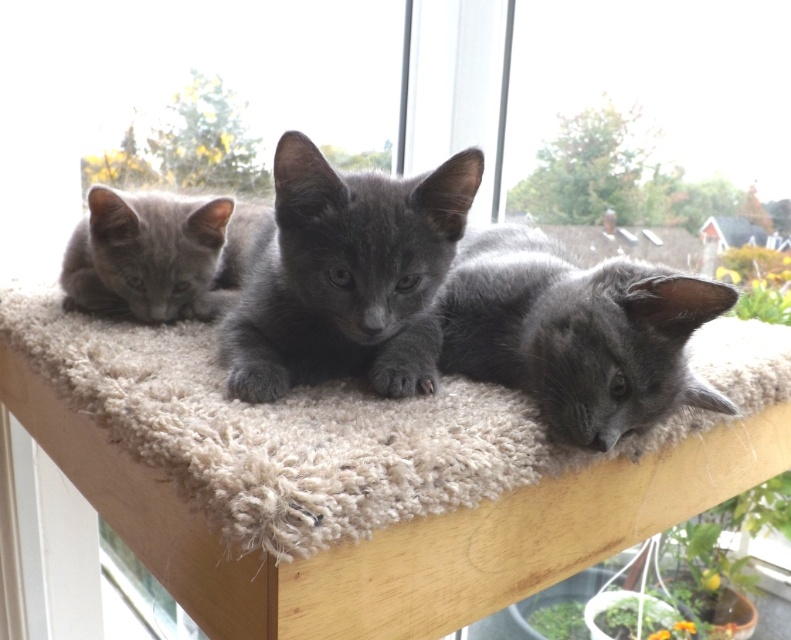
Question: Which object is positioned closest to the shiny gray kitten at center?

Choices:
 (A) beige shaggy carpet at center
 (B) matte gray kitten at left
 (C) shiny black kitten at center

Answer: (C)

Question: Is shiny gray kitten at center further to camera compared to matte gray kitten at left?

Choices:
 (A) no
 (B) yes

Answer: (A)

Question: Which of these objects is positioned closest to the matte gray kitten at left?

Choices:
 (A) shiny gray kitten at center
 (B) shiny black kitten at center

Answer: (B)

Question: From the image, what is the correct spatial relationship of beige shaggy carpet at center in relation to matte gray kitten at left?

Choices:
 (A) left
 (B) right

Answer: (B)

Question: Estimate the real-world distances between objects in this image. Which object is closer to the beige shaggy carpet at center?

Choices:
 (A) matte gray kitten at left
 (B) shiny gray kitten at center

Answer: (B)

Question: Is shiny gray kitten at center in front of matte gray kitten at left?

Choices:
 (A) no
 (B) yes

Answer: (B)